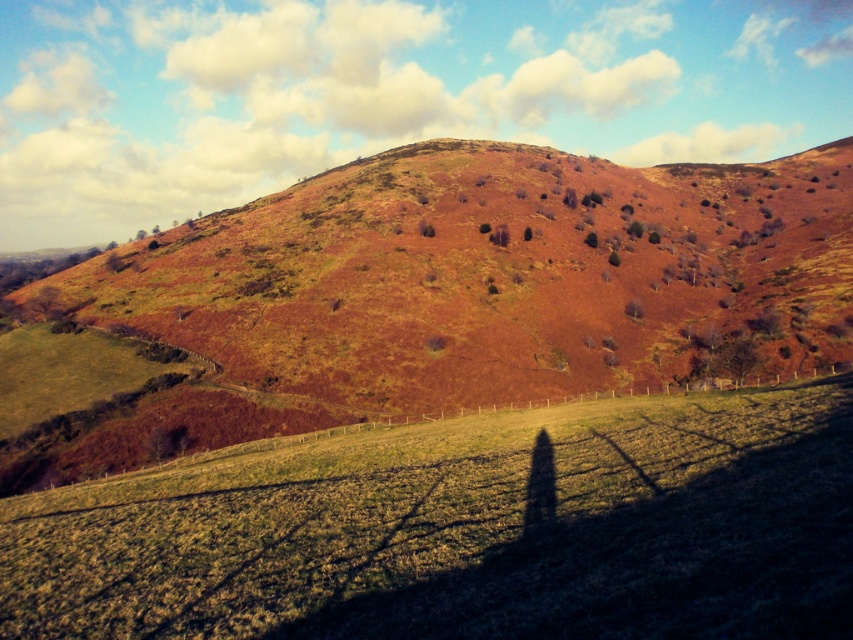
You are standing at the point marked as point (x=590, y=237) in the image. What object is directly in front of you?

The green matte tree at center is directly in front of you at point (x=590, y=237).

In the scene shown: You are standing at the point marked by the coordinates point (426, 301) in the image. Looking around, you see a brown grassy hillside at center. What is the immediate terrain feature under your feet?

The point (426, 301) marks the brown grassy hillside at center, so the immediate terrain feature under your feet is the brown grassy hillside at center.